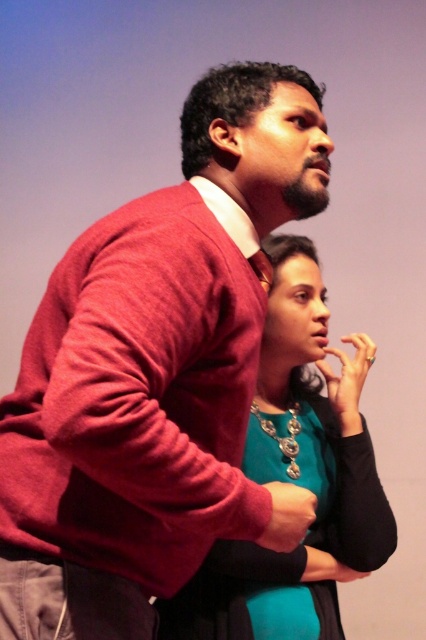
In the scene shown: Between matte red sweater at upper left and teal satin blouse at center, which one appears on the left side from the viewer's perspective?

Positioned to the left is matte red sweater at upper left.

Is matte red sweater at upper left taller than teal satin blouse at center?

Yes.

Which is behind, point (63, 339) or point (322, 515)?

The point (322, 515) is behind.

Where is `matte red sweater at upper left`? Image resolution: width=426 pixels, height=640 pixels. matte red sweater at upper left is located at coordinates (157, 372).